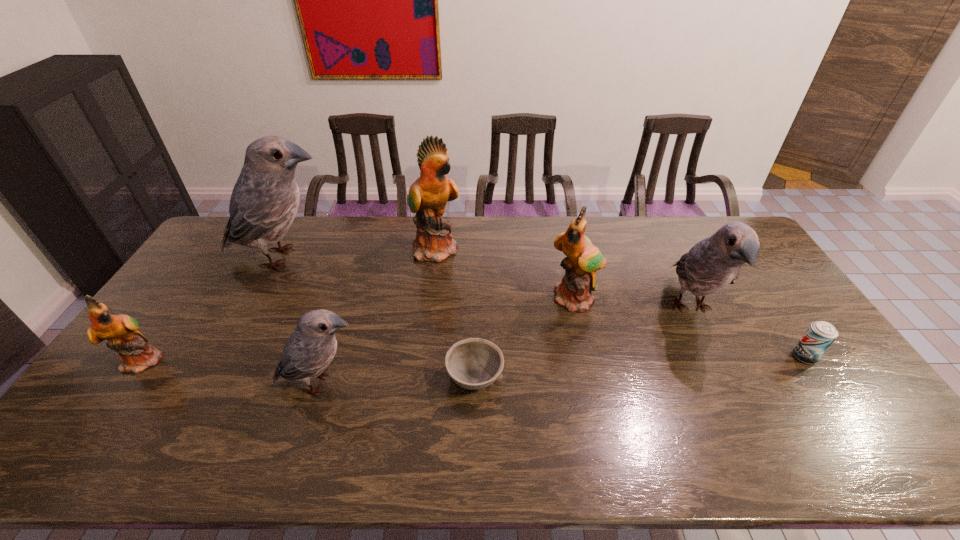
This screenshot has height=540, width=960. I want to click on parrot that is the fifth closest to the leftmost green parrot, so click(712, 264).

Locate an element on the screen. gray parrot identified as the second closest to the nearest gray parrot is located at coordinates (712, 264).

Image resolution: width=960 pixels, height=540 pixels. I want to click on gray parrot identified as the closest to the second nearest gray parrot, so click(309, 350).

Select which green parrot is the closest to the second object from right to left. Please provide its 2D coordinates. Your answer should be formatted as a tuple, i.e. [(x, y)], where the tuple contains the x and y coordinates of a point satisfying the conditions above.

[(583, 259)]

Where is `the closest green parrot to the smallest green parrot`? the closest green parrot to the smallest green parrot is located at coordinates (428, 195).

The width and height of the screenshot is (960, 540). I want to click on free spot that satisfies the following two spatial constraints: 1. on the front-facing side of the third parrot from right to left; 2. on the back side of the shortest object, so point(421,377).

At what (x,y) coordinates should I click in order to perform the action: click on vacant space that satisfies the following two spatial constraints: 1. on the back side of the gray bowl; 2. on the front-facing side of the smallest green parrot. Please return your answer as a coordinate pair (x, y). The height and width of the screenshot is (540, 960). Looking at the image, I should click on (475, 360).

Locate an element on the screen. vacant space that satisfies the following two spatial constraints: 1. on the front side of the seventh tallest object; 2. on the front-facing side of the smallest green parrot is located at coordinates (806, 360).

Where is `vacant area that satisfies the following two spatial constraints: 1. on the front-facing side of the beer can; 2. on the left side of the second green parrot from right to left`? The width and height of the screenshot is (960, 540). vacant area that satisfies the following two spatial constraints: 1. on the front-facing side of the beer can; 2. on the left side of the second green parrot from right to left is located at coordinates (424, 357).

Where is `vacant region that satisfies the following two spatial constraints: 1. on the front side of the rightmost object; 2. on the front-facing side of the nearest gray parrot`? vacant region that satisfies the following two spatial constraints: 1. on the front side of the rightmost object; 2. on the front-facing side of the nearest gray parrot is located at coordinates (823, 383).